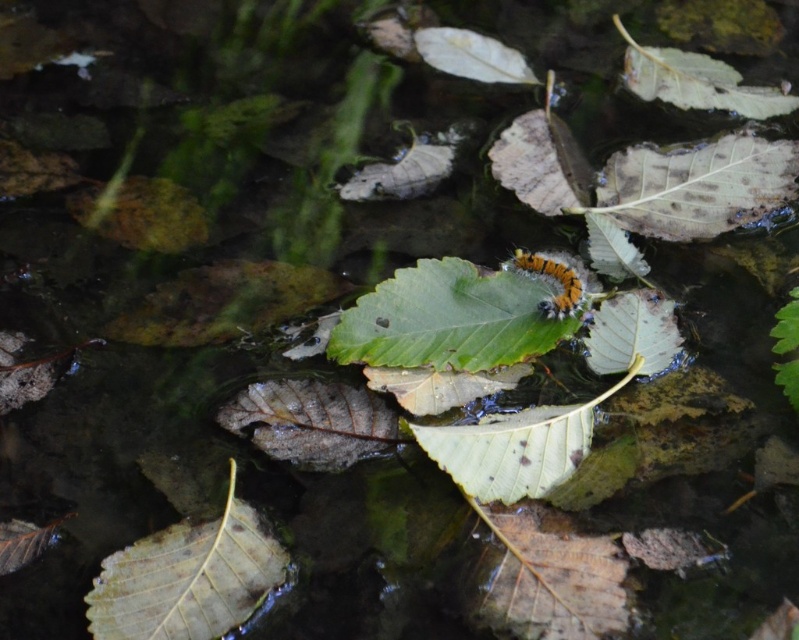
You are standing at the edge of the water and see two points in the scene. The first point is at coordinates point (493, 337) and the second is at point (531, 273). Which point is closer to you?

Point (493, 337) is in front of point (531, 273), so it is closer to you.

You are a small insect trying to reach the green matte leaf at lower left from the green matte leaf at center. Which direction should you move to get there?

The green matte leaf at center is positioned over the green matte leaf at lower left, so to reach the lower left leaf, you should move downward and to the left away from the central leaf.